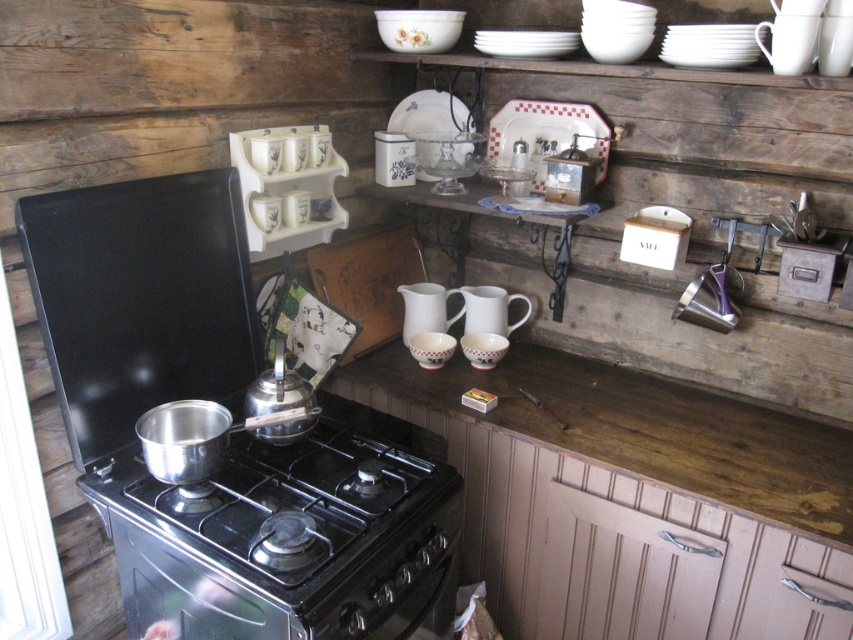
The height and width of the screenshot is (640, 853). I want to click on white matte pitcher at center, so click(425, 308).

Where is `white matte pitcher at center`? The width and height of the screenshot is (853, 640). white matte pitcher at center is located at coordinates (425, 308).

Is point (531, 163) behind point (399, 292)?

No, (531, 163) is in front of (399, 292).

Does white glossy plate at upper center appear on the right side of white matte pitcher at center?

Indeed, white glossy plate at upper center is positioned on the right side of white matte pitcher at center.

Who is more distant from viewer, (x=555, y=150) or (x=456, y=316)?

The point (x=456, y=316) is behind.

This screenshot has width=853, height=640. Find the location of `white glossy plate at upper center`. white glossy plate at upper center is located at coordinates (547, 134).

Who is taller, black matte exhaust hood at upper left or white matte pitcher at center?

black matte exhaust hood at upper left is taller.

Which of these two, black matte exhaust hood at upper left or white matte pitcher at center, stands shorter?

Standing shorter between the two is white matte pitcher at center.

What are the coordinates of `black matte exhaust hood at upper left` in the screenshot? It's located at [x=140, y=300].